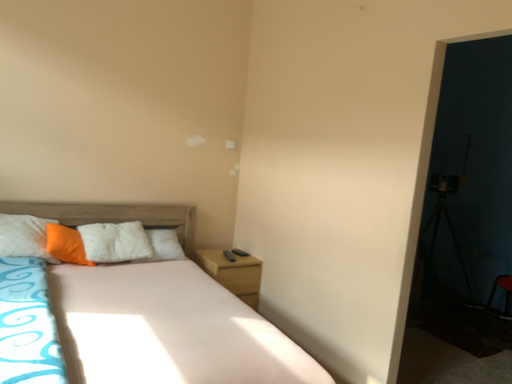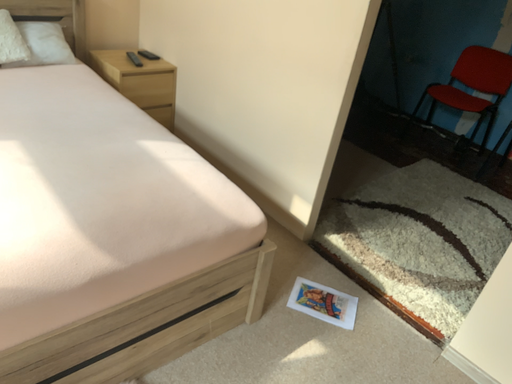
Question: How did the camera likely rotate when shooting the video?

Choices:
 (A) rotated left
 (B) rotated right

Answer: (B)